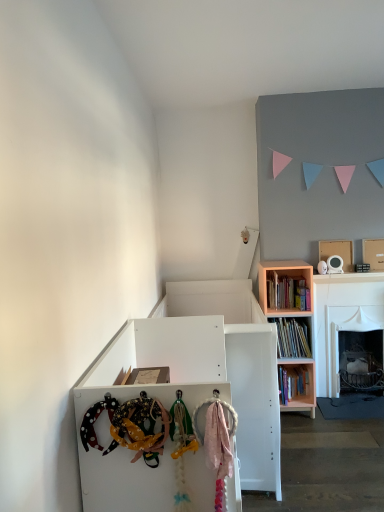
Question: Is white matte cabinet at center behind white cardboard box at upper right?

Choices:
 (A) yes
 (B) no

Answer: (B)

Question: From the image's perspective, is white matte cabinet at center located beneath white cardboard box at upper right?

Choices:
 (A) no
 (B) yes

Answer: (B)

Question: Can you confirm if white matte cabinet at center is smaller than white cardboard box at upper right?

Choices:
 (A) no
 (B) yes

Answer: (A)

Question: Is white matte cabinet at center beside white cardboard box at upper right?

Choices:
 (A) no
 (B) yes

Answer: (A)

Question: Is the depth of white matte cabinet at center less than that of white cardboard box at upper right?

Choices:
 (A) yes
 (B) no

Answer: (A)

Question: Based on their positions, is pink wood bookcase at right located to the left or right of pink matte bookshelf at upper right?

Choices:
 (A) right
 (B) left

Answer: (A)

Question: From the image's perspective, relative to pink matte bookshelf at upper right, is pink wood bookcase at right above or below?

Choices:
 (A) above
 (B) below

Answer: (B)

Question: In terms of width, does pink wood bookcase at right look wider or thinner when compared to pink matte bookshelf at upper right?

Choices:
 (A) thin
 (B) wide

Answer: (B)

Question: Looking at the image, does pink wood bookcase at right seem bigger or smaller compared to pink matte bookshelf at upper right?

Choices:
 (A) small
 (B) big

Answer: (B)

Question: In the image, is white cardboard box at upper right on the left side or the right side of pink wood bookcase at right?

Choices:
 (A) right
 (B) left

Answer: (A)

Question: Does point (324, 243) appear closer or farther from the camera than point (294, 367)?

Choices:
 (A) closer
 (B) farther

Answer: (B)

Question: Based on their sizes in the image, would you say white cardboard box at upper right is bigger or smaller than pink wood bookcase at right?

Choices:
 (A) big
 (B) small

Answer: (B)

Question: In the image, is white cardboard box at upper right positioned in front of or behind pink wood bookcase at right?

Choices:
 (A) front
 (B) behind

Answer: (B)

Question: Considering the positions of pink matte bookshelf at upper right and polka dot fabric headband at lower left in the image, is pink matte bookshelf at upper right bigger or smaller than polka dot fabric headband at lower left?

Choices:
 (A) small
 (B) big

Answer: (B)

Question: In terms of width, does pink matte bookshelf at upper right look wider or thinner when compared to polka dot fabric headband at lower left?

Choices:
 (A) thin
 (B) wide

Answer: (B)